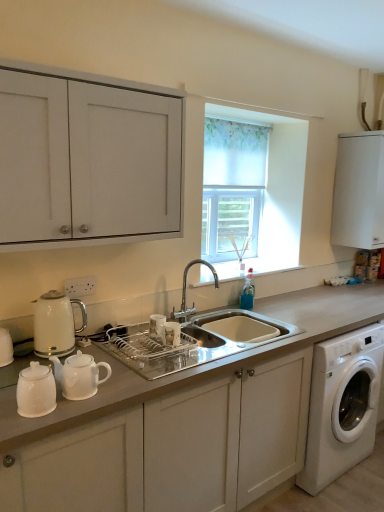
Question: In terms of width, does clear plastic dish at center look wider or thinner when compared to translucent fabric at center?

Choices:
 (A) wide
 (B) thin

Answer: (B)

Question: From their relative heights in the image, would you say clear plastic dish at center is taller or shorter than translucent fabric at center?

Choices:
 (A) short
 (B) tall

Answer: (A)

Question: Based on their relative distances, which object is farther from the white glossy electric kettle at left?

Choices:
 (A) clear plastic dish at center
 (B) blue translucent soap dispenser at sink right
 (C) translucent fabric at center
 (D) white matte cabinet at upper right, arranged as the third cabinetry when viewed from the left
 (E) white glossy teapot at lower left

Answer: (D)

Question: Which is farther from the white glossy teapot at lower left?

Choices:
 (A) white matte cabinet at upper left, placed as the third cabinetry when sorted from right to left
 (B) translucent fabric at center
 (C) white plastic washing machine at lower right
 (D) clear plastic dish at center
 (E) white glossy electric kettle at left

Answer: (B)